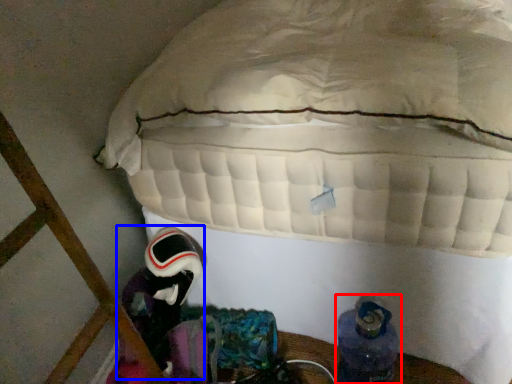
Question: Which of the following is the farthest to the observer, footwear (highlighted by a red box) or astronaut (highlighted by a blue box)?

Choices:
 (A) footwear
 (B) astronaut

Answer: (B)